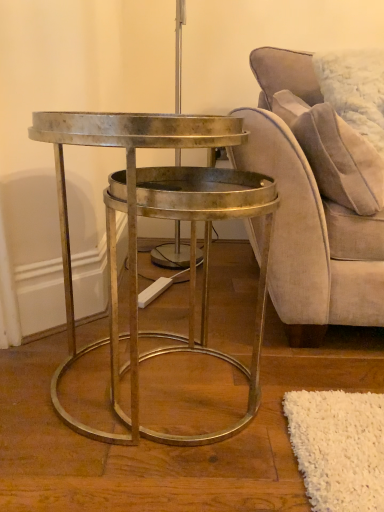
Question: Considering the relative sizes of suede-like beige pillow at upper right and suede beige chair at right in the image provided, is suede-like beige pillow at upper right bigger than suede beige chair at right?

Choices:
 (A) yes
 (B) no

Answer: (B)

Question: Is suede-like beige pillow at upper right not near suede beige chair at right?

Choices:
 (A) yes
 (B) no

Answer: (B)

Question: Is suede-like beige pillow at upper right outside suede beige chair at right?

Choices:
 (A) yes
 (B) no

Answer: (B)

Question: From the image's perspective, is suede-like beige pillow at upper right located beneath suede beige chair at right?

Choices:
 (A) yes
 (B) no

Answer: (B)

Question: Can you confirm if suede-like beige pillow at upper right is taller than suede beige chair at right?

Choices:
 (A) no
 (B) yes

Answer: (A)

Question: Is metallic gold table at center taller or shorter than suede-like beige pillow at upper right?

Choices:
 (A) tall
 (B) short

Answer: (A)

Question: From a real-world perspective, relative to suede-like beige pillow at upper right, is metallic gold table at center vertically above or below?

Choices:
 (A) below
 (B) above

Answer: (A)

Question: From the image's perspective, is metallic gold table at center located above or below suede-like beige pillow at upper right?

Choices:
 (A) below
 (B) above

Answer: (A)

Question: Is metallic gold table at center inside or outside of suede-like beige pillow at upper right?

Choices:
 (A) inside
 (B) outside

Answer: (B)

Question: From the image's perspective, is suede-like beige pillow at upper right above or below metallic gold table at center?

Choices:
 (A) below
 (B) above

Answer: (B)

Question: Is suede-like beige pillow at upper right to the left or to the right of metallic gold table at center in the image?

Choices:
 (A) right
 (B) left

Answer: (A)

Question: In the image, is suede-like beige pillow at upper right positioned in front of or behind metallic gold table at center?

Choices:
 (A) front
 (B) behind

Answer: (B)

Question: Is suede-like beige pillow at upper right wider or thinner than metallic gold table at center?

Choices:
 (A) thin
 (B) wide

Answer: (A)

Question: Considering the positions of point (364, 232) and point (183, 183), is point (364, 232) closer or farther from the camera than point (183, 183)?

Choices:
 (A) closer
 (B) farther

Answer: (B)

Question: From the image's perspective, relative to metallic gold table at center, is suede beige chair at right above or below?

Choices:
 (A) above
 (B) below

Answer: (A)